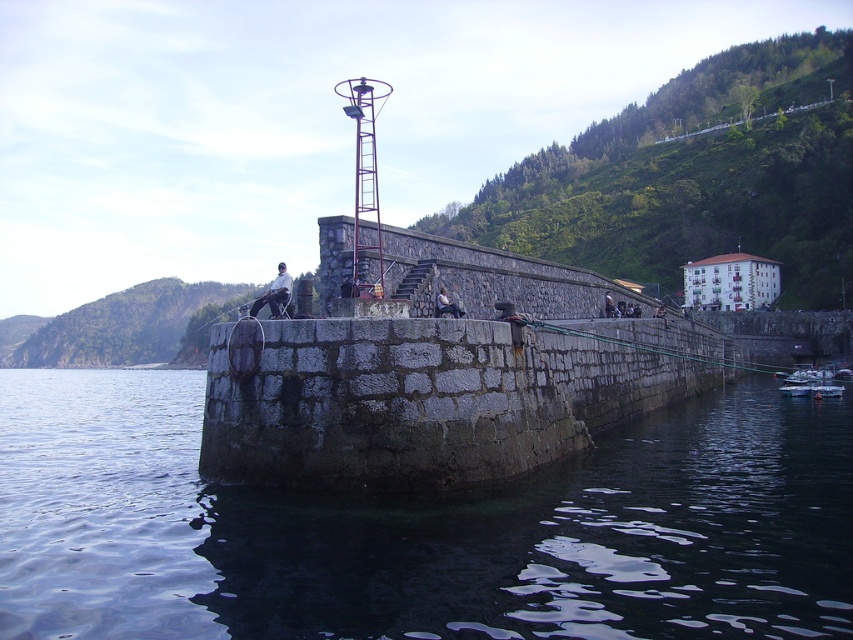
You are standing on the pier and see the dark blue water at lower left and the dark gray stone person at center. Which object is nearer to you?

The dark blue water at lower left is closer to the viewer than the dark gray stone person at center.

You are standing on the stone pier and want to locate the dark blue water at lower left. According to the coordinates provided, can you determine its exact location on the pier?

The dark blue water at lower left is located at coordinates point (421, 529).

You are standing on the pier and see the white fabric at center. You want to reach it but you have a 30 meter rope. Can you safely reach it using the rope?

The white fabric at center is 31.64 meters away from the viewer. Since the rope is only 30 meters long, it is not long enough to safely reach the white fabric at center.